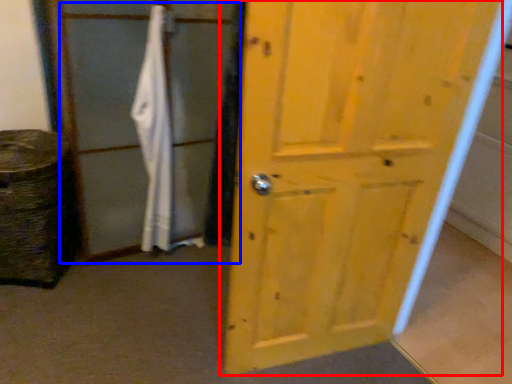
Question: Which of the following is the closest to the observer, door (highlighted by a red box) or screen door (highlighted by a blue box)?

Choices:
 (A) door
 (B) screen door

Answer: (A)